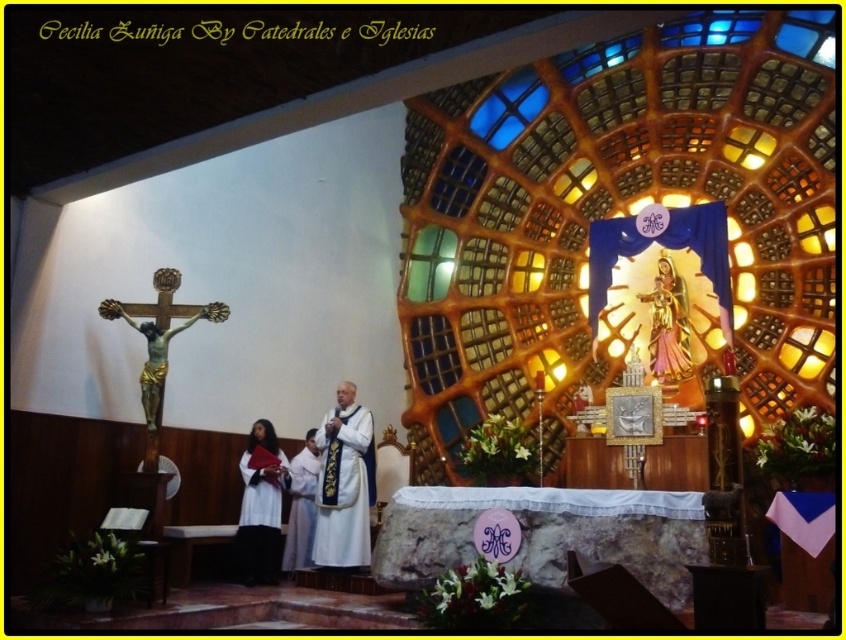
Question: Which of the following is the closest to the observer?

Choices:
 (A) white silk vestment at center
 (B) white clothed person at center
 (C) gold polished crucifix at left

Answer: (C)

Question: Is gold metallic statue at upper center to the right of white clothed person at center from the viewer's perspective?

Choices:
 (A) yes
 (B) no

Answer: (A)

Question: Which of these objects is positioned farthest from the gold polished crucifix at left?

Choices:
 (A) white clothed person at center
 (B) gold metallic statue at upper center
 (C) black cloth at lower left

Answer: (B)

Question: Does white silk vestment at center appear on the right side of black cloth at lower left?

Choices:
 (A) yes
 (B) no

Answer: (A)

Question: Does gold metallic statue at upper center come in front of gold polished crucifix at left?

Choices:
 (A) yes
 (B) no

Answer: (B)

Question: Which point is farther to the camera?

Choices:
 (A) gold metallic statue at upper center
 (B) black cloth at lower left
 (C) gold polished crucifix at left
 (D) white silk vestment at center

Answer: (A)